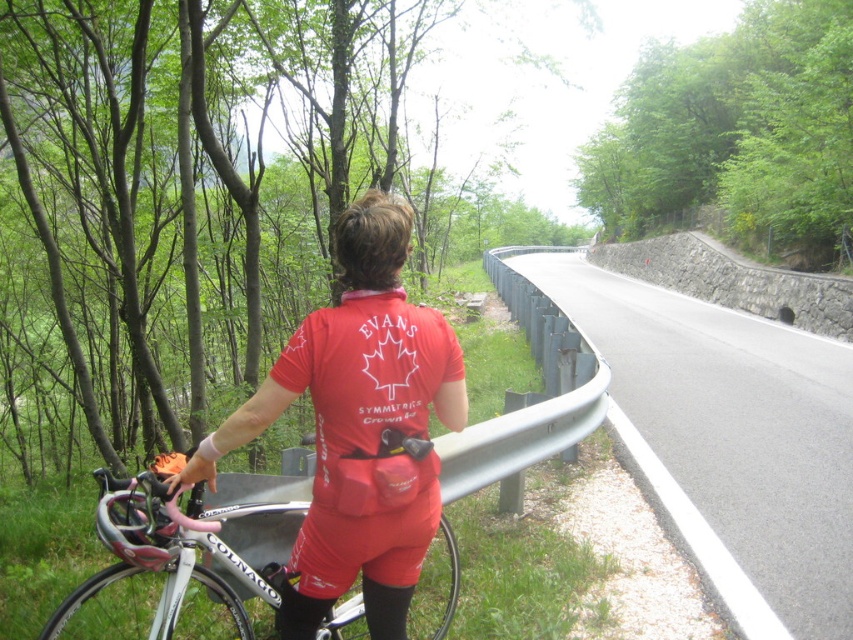
Question: Which of these objects is positioned farthest from the asphalt road at center?

Choices:
 (A) red matte cycling jersey at center
 (B) shiny black helmet at left

Answer: (B)

Question: Which point is farther to the camera?

Choices:
 (A) asphalt road at center
 (B) white glossy bicycle at center

Answer: (A)

Question: Estimate the real-world distances between objects in this image. Which object is closer to the white glossy bicycle at center?

Choices:
 (A) red matte cycling jersey at center
 (B) shiny black helmet at left

Answer: (A)

Question: Can you confirm if white glossy bicycle at center is wider than shiny black helmet at left?

Choices:
 (A) yes
 (B) no

Answer: (A)

Question: Can you confirm if asphalt road at center is positioned below shiny black helmet at left?

Choices:
 (A) no
 (B) yes

Answer: (A)

Question: Does asphalt road at center have a greater width compared to red matte cycling jersey at center?

Choices:
 (A) no
 (B) yes

Answer: (B)